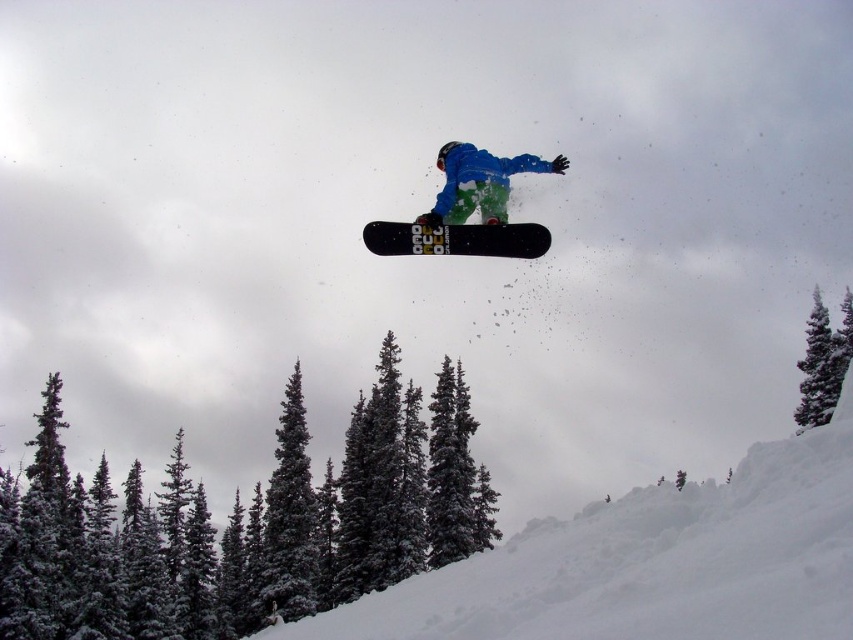
You are a photographer trying to capture the snowboarder and the trees in the same frame. Based on the scene, which object is taller and would require adjusting the camera angle upwards to include both the snowy evergreen trees at lower left and the matte black snowboard at center in the photo?

The snowy evergreen trees at lower left are taller than the matte black snowboard at center, so you would need to angle the camera upwards to include both in the frame.

You are a photographer trying to capture the snowboarder in the center of your photo. The snowy evergreen trees at lower left are blocking your view. To get a clear shot of the snowboarder, which direction should you move your camera?

Since the snowy evergreen trees at lower left are located at point [244,524], you should move your camera to the right or upwards to avoid the obstruction caused by the snowy evergreen trees at lower left.